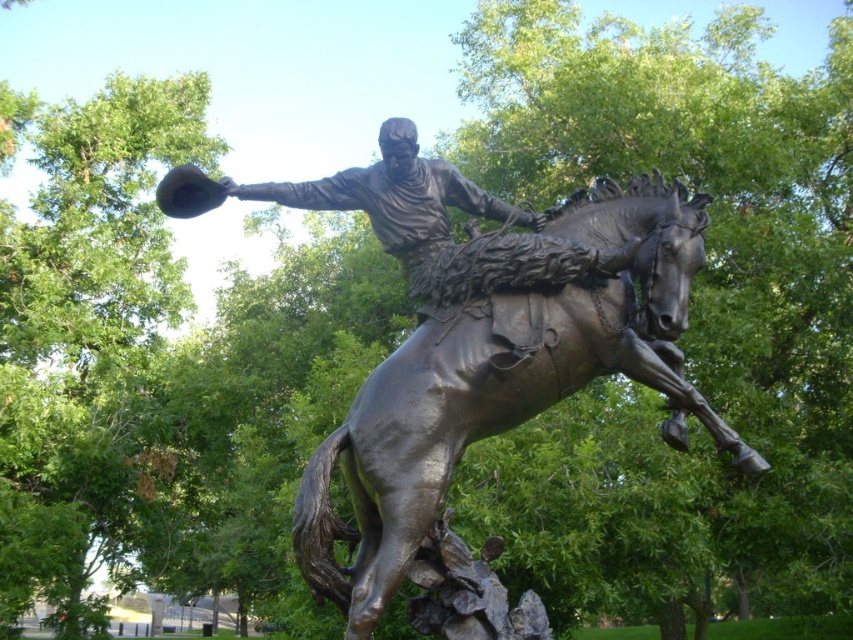
Question: Does bronze horse at center have a smaller size compared to bronze statue at center?

Choices:
 (A) yes
 (B) no

Answer: (B)

Question: Does bronze horse at center appear over bronze statue at center?

Choices:
 (A) no
 (B) yes

Answer: (A)

Question: Which of the following is the farthest from the observer?

Choices:
 (A) bronze statue at center
 (B) bronze horse at center

Answer: (A)

Question: Is bronze horse at center to the right of bronze statue at center from the viewer's perspective?

Choices:
 (A) yes
 (B) no

Answer: (A)